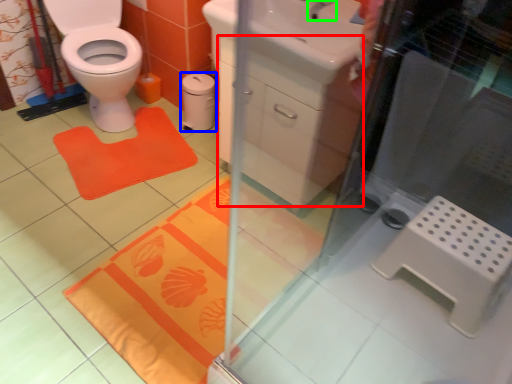
Question: Based on their relative distances, which object is farther from drawer (highlighted by a red box)? Choose from toilet paper (highlighted by a blue box) and tap (highlighted by a green box).

Choices:
 (A) toilet paper
 (B) tap

Answer: (A)